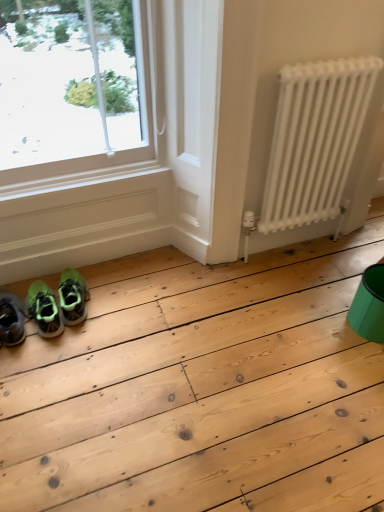
Where is `green matte sneakers at lower left`? Image resolution: width=384 pixels, height=512 pixels. green matte sneakers at lower left is located at coordinates 73,297.

Identify the location of green matte sneakers at lower left. (73, 297).

Is teal plastic bucket at lower right closer to the viewer compared to green matte sneakers at lower left?

That is True.

Based on the photo, looking at the image, does teal plastic bucket at lower right seem bigger or smaller compared to green matte sneakers at lower left?

In the image, teal plastic bucket at lower right appears to be larger than green matte sneakers at lower left.

Is teal plastic bucket at lower right inside or outside of green matte sneakers at lower left?

teal plastic bucket at lower right is outside green matte sneakers at lower left.

Is teal plastic bucket at lower right looking in the opposite direction of green matte sneakers at lower left?

No.

Which is less distant, (301, 93) or (377, 336)?

Point (301, 93) is closer to the camera than point (377, 336).

Based on the photo, considering the sizes of white matte radiator at right and teal plastic bucket at lower right in the image, is white matte radiator at right wider or thinner than teal plastic bucket at lower right?

Clearly, white matte radiator at right has less width compared to teal plastic bucket at lower right.

Is white matte radiator at right in front of or behind teal plastic bucket at lower right in the image?

white matte radiator at right is positioned closer to the viewer than teal plastic bucket at lower right.

Are white matte radiator at right and teal plastic bucket at lower right making contact?

There is a gap between white matte radiator at right and teal plastic bucket at lower right.

From the image's perspective, which is above, green matte sneakers at lower left or white matte radiator at right?

white matte radiator at right, from the image's perspective.

Looking at their sizes, would you say green matte sneakers at lower left is wider or thinner than white matte radiator at right?

In the image, green matte sneakers at lower left appears to be wider than white matte radiator at right.

In the scene shown: Can you confirm if green matte sneakers at lower left is smaller than white matte radiator at right?

Indeed, green matte sneakers at lower left has a smaller size compared to white matte radiator at right.

Considering the sizes of objects green matte sneakers at lower left and white matte radiator at right in the image provided, who is taller, green matte sneakers at lower left or white matte radiator at right?

white matte radiator at right.

How far apart are teal plastic bucket at lower right and green matte sneakers at lower left?

teal plastic bucket at lower right and green matte sneakers at lower left are 1.17 meters apart from each other.

Is there a large distance between teal plastic bucket at lower right and green matte sneakers at lower left?

Yes, teal plastic bucket at lower right is far from green matte sneakers at lower left.

Considering the relative positions of teal plastic bucket at lower right and green matte sneakers at lower left in the image provided, is teal plastic bucket at lower right to the left of green matte sneakers at lower left from the viewer's perspective?

No, teal plastic bucket at lower right is not to the left of green matte sneakers at lower left.

Locate an element on the screen. teal on the right of green matte sneakers at lower left is located at coordinates (369, 305).

Is green matte sneakers at lower left located outside green matte sneakers at lower left?

Yes, green matte sneakers at lower left is located beyond the bounds of green matte sneakers at lower left.

From a real-world perspective, who is located higher, green matte sneakers at lower left or green matte sneakers at lower left?

green matte sneakers at lower left.

Is green matte sneakers at lower left facing away from green matte sneakers at lower left?

No, green matte sneakers at lower left is not facing the opposite direction of green matte sneakers at lower left.

Does point (76, 316) lie in front of point (61, 331)?

No, (76, 316) is further to viewer.

Considering the sizes of green matte sneakers at lower left and teal plastic bucket at lower right in the image, is green matte sneakers at lower left taller or shorter than teal plastic bucket at lower right?

green matte sneakers at lower left is shorter than teal plastic bucket at lower right.

Considering the relative sizes of green matte sneakers at lower left and teal plastic bucket at lower right in the image provided, is green matte sneakers at lower left bigger than teal plastic bucket at lower right?

No.

Is the surface of green matte sneakers at lower left in direct contact with teal plastic bucket at lower right?

green matte sneakers at lower left and teal plastic bucket at lower right are clearly separated.

What's the angular difference between green matte sneakers at lower left and teal plastic bucket at lower right's facing directions?

They differ by 6.03 degrees in their facing directions.

From a real-world perspective, is green matte sneakers at lower left positioned under teal plastic bucket at lower right based on gravity?

Yes.

Is green matte sneakers at lower left looking in the opposite direction of teal plastic bucket at lower right?

green matte sneakers at lower left does not have its back to teal plastic bucket at lower right.

From the image's perspective, is green matte sneakers at lower left located above teal plastic bucket at lower right?

Yes, from the image's perspective, green matte sneakers at lower left is above teal plastic bucket at lower right.

Which is correct: green matte sneakers at lower left is inside teal plastic bucket at lower right, or outside of it?

The correct answer is: outside.

Find the location of `teal on the right of green matte sneakers at lower left`. teal on the right of green matte sneakers at lower left is located at coordinates (369, 305).

At what (x,y) coordinates should I click in order to perform the action: click on radiator positioned vertically above the teal plastic bucket at lower right (from a real-world perspective). Please return your answer as a coordinate pair (x, y). Image resolution: width=384 pixels, height=512 pixels. Looking at the image, I should click on (313, 144).

Looking at the image, which one is located closer to teal plastic bucket at lower right, green matte sneakers at lower left or white matte radiator at right?

white matte radiator at right.

From the image, which object appears to be farther from green matte sneakers at lower left, green matte sneakers at lower left or white matte radiator at right?

The object further to green matte sneakers at lower left is white matte radiator at right.

When comparing their distances from teal plastic bucket at lower right, does white matte radiator at right or green matte sneakers at lower left seem further?

green matte sneakers at lower left is positioned further to the anchor teal plastic bucket at lower right.

Considering their positions, is green matte sneakers at lower left positioned closer to white matte radiator at right than green matte sneakers at lower left?

Among the two, green matte sneakers at lower left is located nearer to white matte radiator at right.

Estimate the real-world distances between objects in this image. Which object is further from green matte sneakers at lower left, teal plastic bucket at lower right or green matte sneakers at lower left?

The object further to green matte sneakers at lower left is teal plastic bucket at lower right.

Looking at the image, which one is located further to green matte sneakers at lower left, teal plastic bucket at lower right or white matte radiator at right?

teal plastic bucket at lower right is positioned further to the anchor green matte sneakers at lower left.

From the image, which object appears to be nearer to teal plastic bucket at lower right, white matte radiator at right or green matte sneakers at lower left?

white matte radiator at right is positioned closer to the anchor teal plastic bucket at lower right.

In the scene shown: Estimate the real-world distances between objects in this image. Which object is further from green matte sneakers at lower left, green matte sneakers at lower left or white matte radiator at right?

white matte radiator at right is further to green matte sneakers at lower left.

You are a GUI agent. You are given a task and a screenshot of the screen. Output one action in this format:
    pyautogui.click(x=<x>, y=<y>)
    Task: Click on the radiator between green matte sneakers at lower left and teal plastic bucket at lower right
    The image size is (384, 512).
    Given the screenshot: What is the action you would take?
    pyautogui.click(x=313, y=144)

Locate an element on the screen. The image size is (384, 512). footwear situated between green matte sneakers at lower left and teal plastic bucket at lower right from left to right is located at coordinates (73, 297).

Locate an element on the screen. The image size is (384, 512). footwear between green matte sneakers at lower left and white matte radiator at right is located at coordinates (73, 297).

The width and height of the screenshot is (384, 512). Identify the location of radiator located between green matte sneakers at lower left and teal plastic bucket at lower right in the left-right direction. (313, 144).